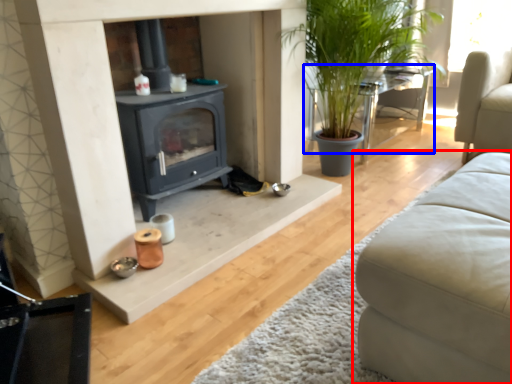
Question: Which of the following is the farthest to the observer, studio couch (highlighted by a red box) or table (highlighted by a blue box)?

Choices:
 (A) studio couch
 (B) table

Answer: (B)